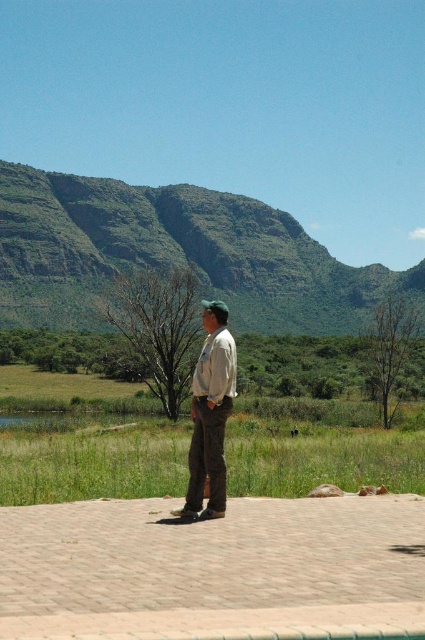
You are a hiker who wants to take a photo of the green grass at center from the green rocky mountain at upper center. Is the mountain tall enough to provide a good vantage point for the photo?

The green rocky mountain at upper center has a greater height compared to the green grass at center, so yes, the mountain is tall enough to provide a good vantage point for the photo.

You are a hiker who wants to take a photo of the green grass at center without any obstruction. Since you are standing near the khaki pants at center, can you move forward to capture the grass clearly?

The khaki pants at center is behind green grass at center, so moving forward would bring you closer to the green grass at center and away from the khaki pants at center. However, since the khaki pants are already behind the grass, there is no obstruction from them. Therefore, you can take the photo without moving as the khaki pants are not in front of the grass.